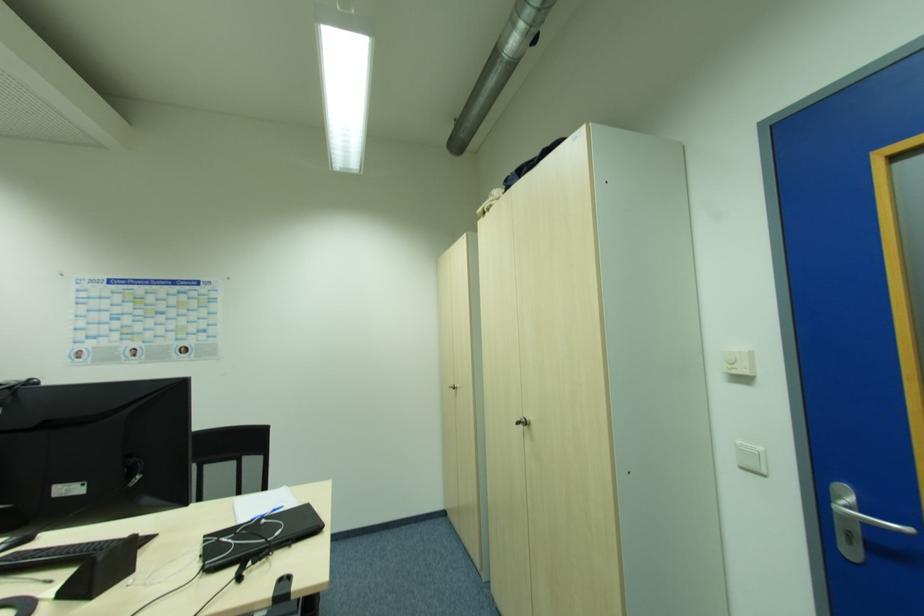
At what (x,y) coordinates should I click in order to perform the action: click on cabinet key lock. Please return your answer as a coordinate pair (x, y). The image size is (924, 616). Looking at the image, I should click on (523, 422).